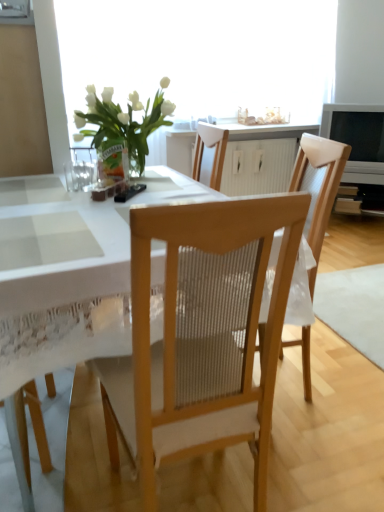
Question: Is translucent glass window screen at upper center positioned in front of white wood cabinet at center?

Choices:
 (A) yes
 (B) no

Answer: (A)

Question: From a real-world perspective, is translucent glass window screen at upper center physically above white wood cabinet at center?

Choices:
 (A) no
 (B) yes

Answer: (B)

Question: Can you see translucent glass window screen at upper center touching white wood cabinet at center?

Choices:
 (A) yes
 (B) no

Answer: (B)

Question: From the image's perspective, is translucent glass window screen at upper center on top of white wood cabinet at center?

Choices:
 (A) no
 (B) yes

Answer: (B)

Question: Is translucent glass window screen at upper center bigger than white wood cabinet at center?

Choices:
 (A) yes
 (B) no

Answer: (A)

Question: From the image's perspective, is translucent glass window screen at upper center located above or below wooden chair at center, marked as the second chair in a front-to-back arrangement?

Choices:
 (A) above
 (B) below

Answer: (A)

Question: Is translucent glass window screen at upper center in front of or behind wooden chair at center, which appears as the first chair when viewed from the back, in the image?

Choices:
 (A) behind
 (B) front

Answer: (A)

Question: Is point (286, 31) closer or farther from the camera than point (294, 183)?

Choices:
 (A) farther
 (B) closer

Answer: (A)

Question: Is translucent glass window screen at upper center inside the boundaries of wooden chair at center, marked as the second chair in a front-to-back arrangement, or outside?

Choices:
 (A) inside
 (B) outside

Answer: (B)

Question: Does point (220, 140) appear closer or farther from the camera than point (306, 374)?

Choices:
 (A) farther
 (B) closer

Answer: (A)

Question: Is white wood cabinet at center inside the boundaries of wooden chair at center, marked as the second chair in a front-to-back arrangement, or outside?

Choices:
 (A) inside
 (B) outside

Answer: (B)

Question: Considering the relative positions of white wood cabinet at center and wooden chair at center, which appears as the first chair when viewed from the back, in the image provided, is white wood cabinet at center to the left or to the right of wooden chair at center, which appears as the first chair when viewed from the back,?

Choices:
 (A) right
 (B) left

Answer: (A)

Question: Is white wood cabinet at center bigger or smaller than wooden chair at center, which appears as the first chair when viewed from the back?

Choices:
 (A) big
 (B) small

Answer: (B)

Question: Considering the positions of translucent glass window screen at upper center and wooden chair at center, the 2th chair when ordered from back to front, in the image, is translucent glass window screen at upper center wider or thinner than wooden chair at center, the 2th chair when ordered from back to front,?

Choices:
 (A) thin
 (B) wide

Answer: (A)

Question: From a real-world perspective, relative to wooden chair at center, the 1th chair viewed from the front, is translucent glass window screen at upper center vertically above or below?

Choices:
 (A) above
 (B) below

Answer: (A)